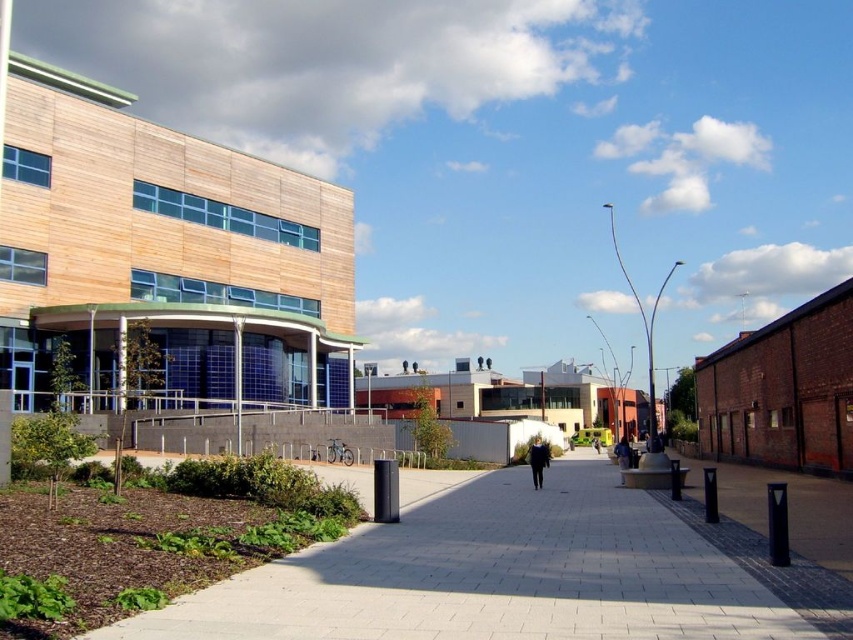
You are a fashion designer observing two jackets displayed at a store window. The jackets are the dark blue jacket at center and the black fabric jacket at center. Which jacket appears taller when viewed from the front?

The dark blue jacket at center is taller than the black fabric jacket at center.

You are a delivery person standing at the entrance of the modern building with a wooden facade. You need to deliver a package to someone wearing a dark blue jacket at center and another to someone wearing a black fabric jacket at center. Which jacket is farther away from you?

The distance between the dark blue jacket at center and the black fabric jacket at center is 37.93 meters. Since you are at the entrance of the modern building, the jacket that is farther away would depend on their positions relative to you. However, the description only provides the distance between the two jackets, not their individual distances from you. Without additional information about their exact locations, it is impossible to determine which jacket is farther away from your current position.

Looking at this image, you are standing at the camera position and want to walk towards the two points marked in the image. Which point, point [614,506] or point [531,444], will you reach first?

Point [614,506] is closer to the camera than point [531,444], so you will reach point [614,506] first.